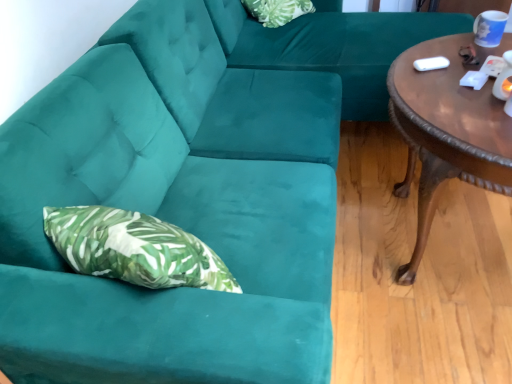
Question: Should I look upward or downward to see green leafy fabric pillow at upper center?

Choices:
 (A) up
 (B) down

Answer: (A)

Question: Would you consider brown polished wood coffee table at right to be distant from green leafy fabric pillow at upper center?

Choices:
 (A) no
 (B) yes

Answer: (B)

Question: Is brown polished wood coffee table at right to the left of green leafy fabric pillow at upper center from the viewer's perspective?

Choices:
 (A) no
 (B) yes

Answer: (A)

Question: Can you confirm if brown polished wood coffee table at right is wider than green leafy fabric pillow at upper center?

Choices:
 (A) no
 (B) yes

Answer: (B)

Question: Can you confirm if brown polished wood coffee table at right is bigger than green leafy fabric pillow at upper center?

Choices:
 (A) yes
 (B) no

Answer: (A)

Question: From a real-world perspective, does brown polished wood coffee table at right sit lower than green leafy fabric pillow at upper center?

Choices:
 (A) yes
 (B) no

Answer: (A)

Question: Can you confirm if brown polished wood coffee table at right is positioned to the right of green leafy fabric pillow at upper center?

Choices:
 (A) yes
 (B) no

Answer: (A)

Question: From a real-world perspective, is green leafy fabric pillow at upper center positioned under velvet green couch at center based on gravity?

Choices:
 (A) yes
 (B) no

Answer: (B)

Question: Is green leafy fabric pillow at upper center behind velvet green couch at center?

Choices:
 (A) yes
 (B) no

Answer: (A)

Question: Would you say green leafy fabric pillow at upper center is a long distance from velvet green couch at center?

Choices:
 (A) no
 (B) yes

Answer: (A)

Question: Can you confirm if green leafy fabric pillow at upper center is taller than velvet green couch at center?

Choices:
 (A) yes
 (B) no

Answer: (B)

Question: From the image's perspective, is green leafy fabric pillow at upper center located beneath velvet green couch at center?

Choices:
 (A) yes
 (B) no

Answer: (B)

Question: Is velvet green couch at center a part of green leafy fabric pillow at upper center?

Choices:
 (A) no
 (B) yes

Answer: (A)

Question: Is velvet green couch at center not inside brown polished wood coffee table at right?

Choices:
 (A) yes
 (B) no

Answer: (A)